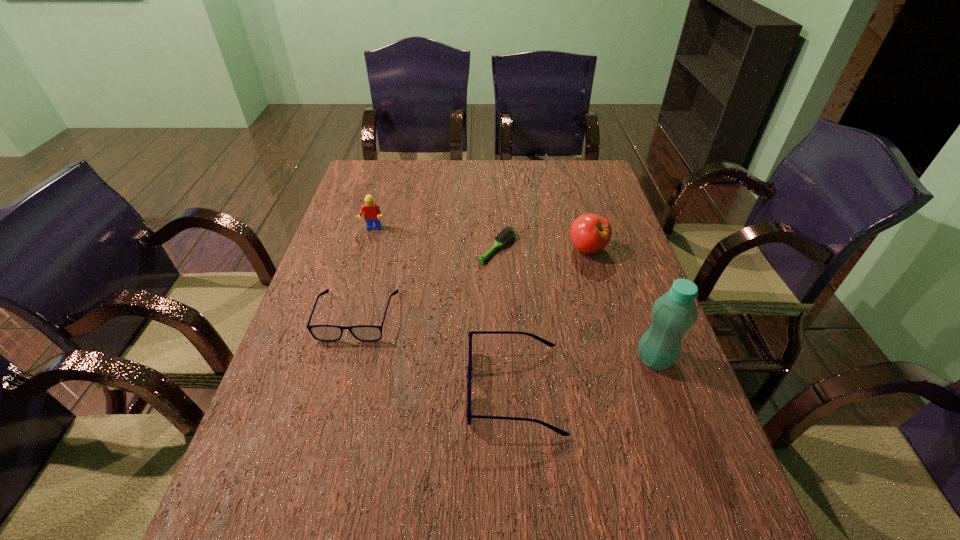
Where is `free space located on the front-facing side of the nearer spectacles`? The width and height of the screenshot is (960, 540). free space located on the front-facing side of the nearer spectacles is located at coordinates (297, 389).

You are a GUI agent. You are given a task and a screenshot of the screen. Output one action in this format:
    pyautogui.click(x=<x>, y=<y>)
    Task: Click on the free space located on the front-facing side of the nearer spectacles
    
    Given the screenshot: What is the action you would take?
    pyautogui.click(x=398, y=389)

At what (x,y) coordinates should I click in order to perform the action: click on free spot located on the right of the hairbrush. Please return your answer as a coordinate pair (x, y). The width and height of the screenshot is (960, 540). Looking at the image, I should click on (609, 248).

At what (x,y) coordinates should I click in order to perform the action: click on free region located 0.130m on the front of the apple. Please return your answer as a coordinate pair (x, y). The image size is (960, 540). Looking at the image, I should click on (600, 294).

I want to click on vacant region located on the front-facing side of the Lego, so click(363, 262).

In order to click on free space located 0.210m at the front cap of the tallest object in this screenshot , I will do `click(694, 469)`.

What are the coordinates of `spectacles at the left edge` in the screenshot? It's located at (328, 333).

Where is `Lego at the left edge`? The width and height of the screenshot is (960, 540). Lego at the left edge is located at coordinates (372, 213).

Where is `apple positioned at the right edge`? apple positioned at the right edge is located at coordinates (590, 233).

Find the location of a particular element. water bottle that is at the right edge is located at coordinates [x=674, y=313].